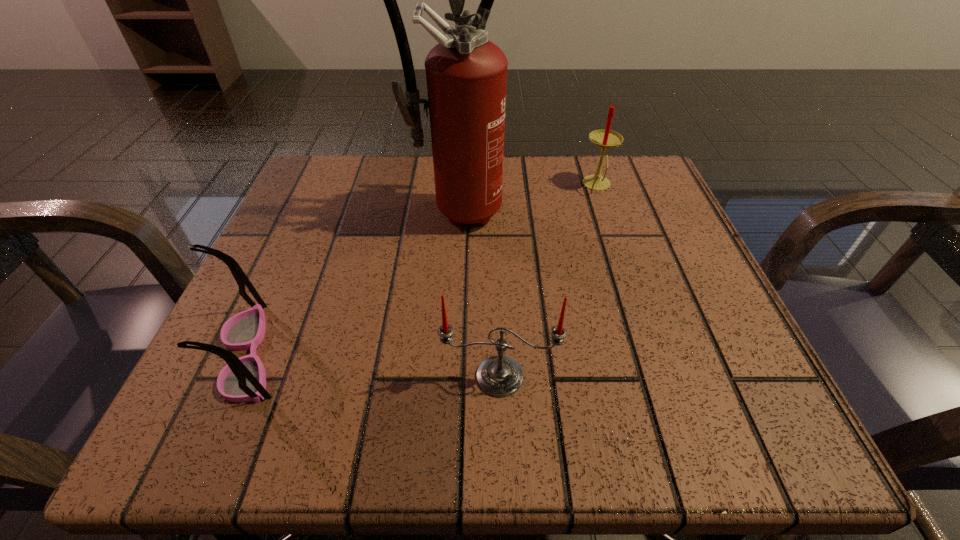
The height and width of the screenshot is (540, 960). Find the location of `fire extinguisher`. fire extinguisher is located at coordinates pos(466,74).

The width and height of the screenshot is (960, 540). Identify the location of the rightmost object. (605, 138).

You are a GUI agent. You are given a task and a screenshot of the screen. Output one action in this format:
    pyautogui.click(x=<x>, y=<y>)
    Task: Click on the right candle
    This screenshot has height=540, width=960.
    Given the screenshot: What is the action you would take?
    pyautogui.click(x=605, y=138)

I want to click on the nearer candle, so click(499, 376).

Where is `spectacles`? The width and height of the screenshot is (960, 540). spectacles is located at coordinates (243, 379).

I want to click on vacant space situated 0.140m at the nozzle of the fire extinguisher, so click(x=448, y=291).

Locate an element on the screen. free location located on the left of the farther candle is located at coordinates (486, 185).

Where is `vacant space situated on the right of the leftmost object`? Image resolution: width=960 pixels, height=540 pixels. vacant space situated on the right of the leftmost object is located at coordinates (360, 354).

Image resolution: width=960 pixels, height=540 pixels. What are the coordinates of `fire extinguisher at the far edge` in the screenshot? It's located at (466, 74).

The width and height of the screenshot is (960, 540). In order to click on candle that is at the far edge in this screenshot , I will do click(605, 138).